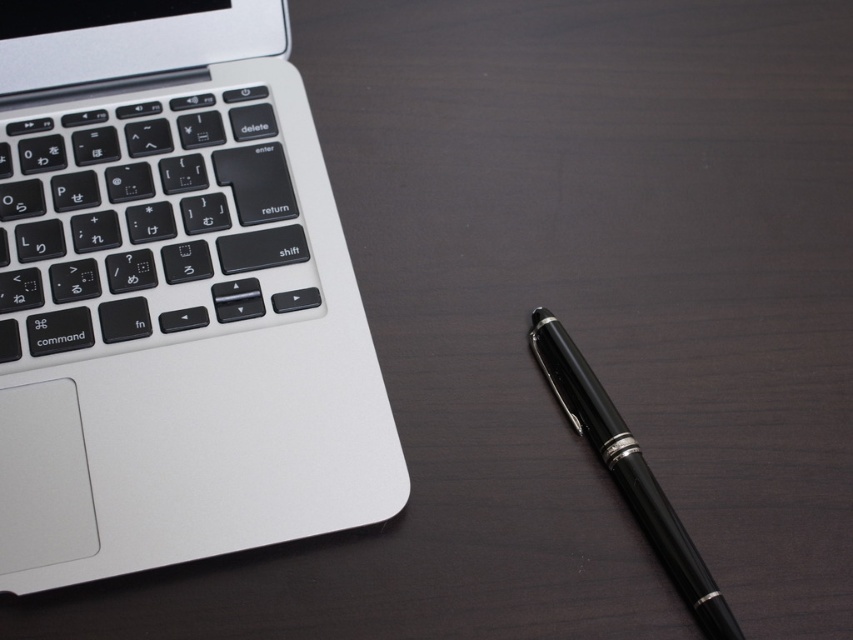
Question: Which is farther from the black polished pen at lower right?

Choices:
 (A) sleek silver laptop at upper left
 (B) black matte keyboard at left

Answer: (B)

Question: Which of the following is the closest to the observer?

Choices:
 (A) (560, 381)
 (B) (283, 168)
 (C) (351, 317)

Answer: (C)

Question: Does black matte keyboard at left come in front of black polished pen at lower right?

Choices:
 (A) yes
 (B) no

Answer: (B)

Question: Among these objects, which one is farthest from the camera?

Choices:
 (A) sleek silver laptop at upper left
 (B) black polished pen at lower right

Answer: (A)

Question: Is sleek silver laptop at upper left closer to the viewer compared to black polished pen at lower right?

Choices:
 (A) yes
 (B) no

Answer: (B)

Question: Is sleek silver laptop at upper left above black polished pen at lower right?

Choices:
 (A) yes
 (B) no

Answer: (A)